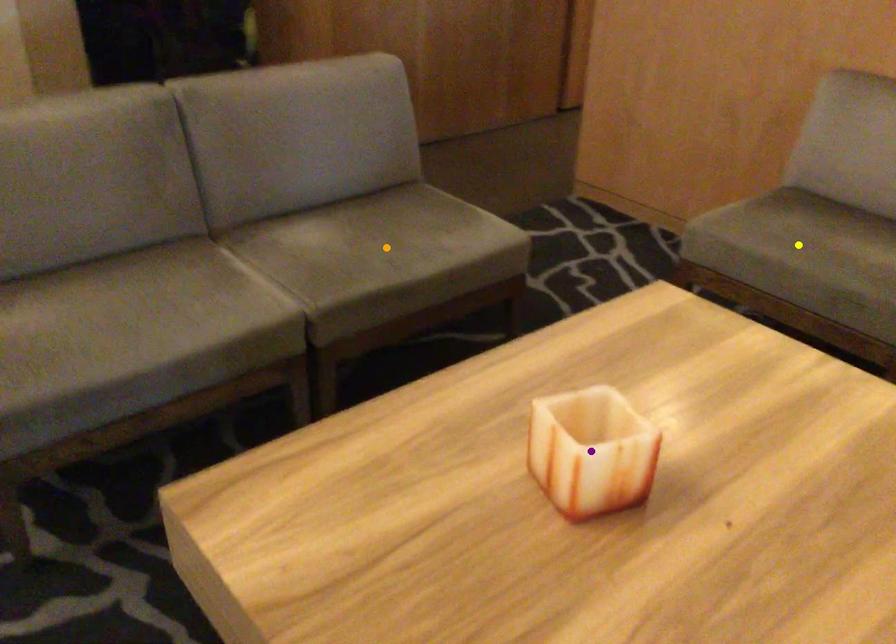
Order these from nearest to farthest:
- yellow point
- purple point
- orange point

1. purple point
2. orange point
3. yellow point